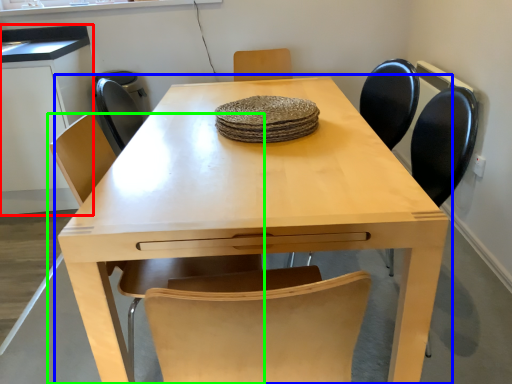
Question: Which is farther away from computer desk (highlighted by a red box)? table (highlighted by a blue box) or chair (highlighted by a green box)?

Choices:
 (A) table
 (B) chair

Answer: (B)